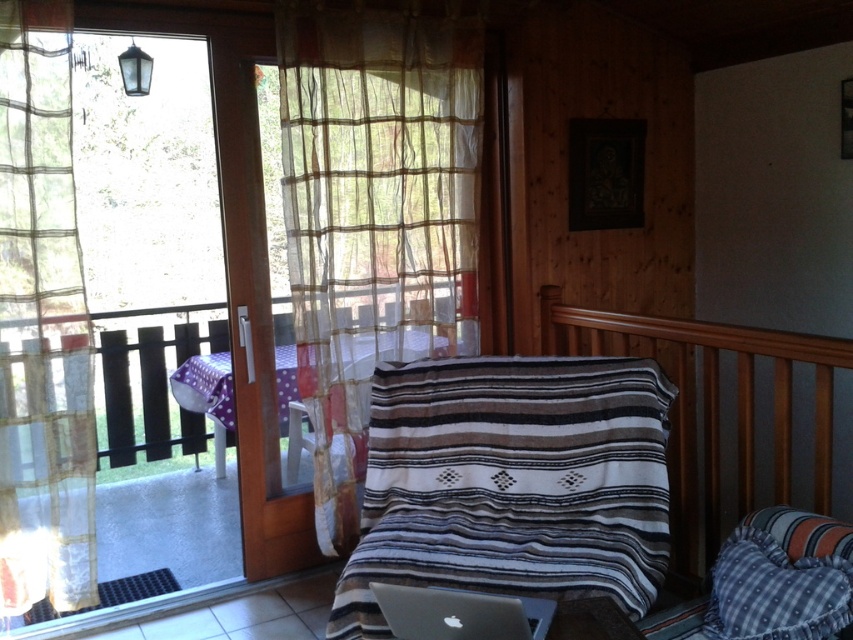
Question: Observing the image, what is the correct spatial positioning of striped woven blanket at center in reference to translucent sheer curtain at left?

Choices:
 (A) left
 (B) right

Answer: (B)

Question: Is striped woven blanket at center smaller than translucent sheer curtain at left?

Choices:
 (A) yes
 (B) no

Answer: (B)

Question: Which point is closer to the camera taking this photo?

Choices:
 (A) (36, 390)
 (B) (477, 356)

Answer: (A)

Question: Which point appears farthest from the camera in this image?

Choices:
 (A) (315, 349)
 (B) (627, 362)
 (C) (761, 586)
 (D) (84, 310)

Answer: (A)

Question: Can you confirm if translucent sheer curtain at upper left is positioned to the left of translucent sheer curtain at left?

Choices:
 (A) yes
 (B) no

Answer: (B)

Question: Among these objects, which one is farthest from the camera?

Choices:
 (A) wooden rail at upper right
 (B) striped woven blanket at center
 (C) blue plaid pillow at lower right
 (D) translucent sheer curtain at left

Answer: (D)